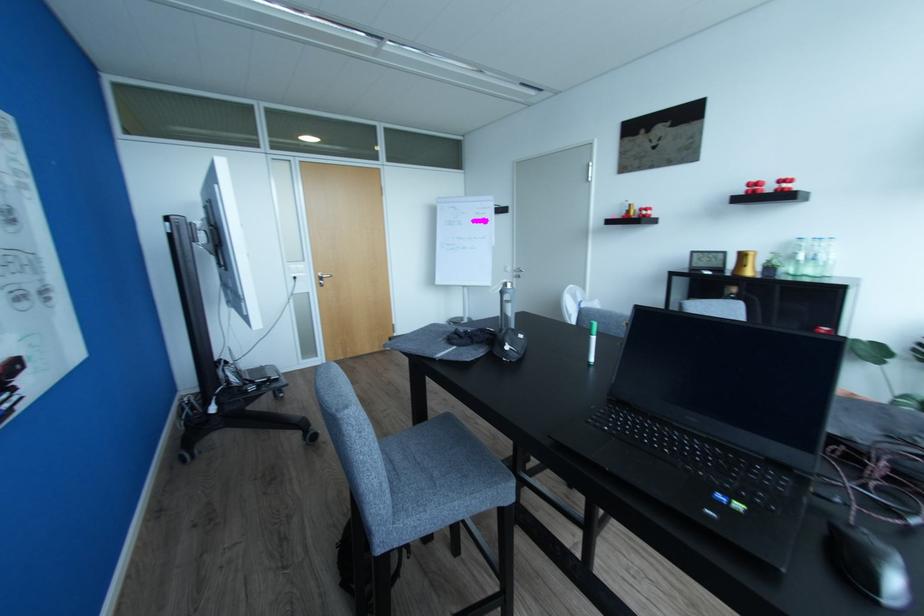
This screenshot has height=616, width=924. Describe the element at coordinates (431, 458) in the screenshot. I see `the grey chair sitting surface` at that location.